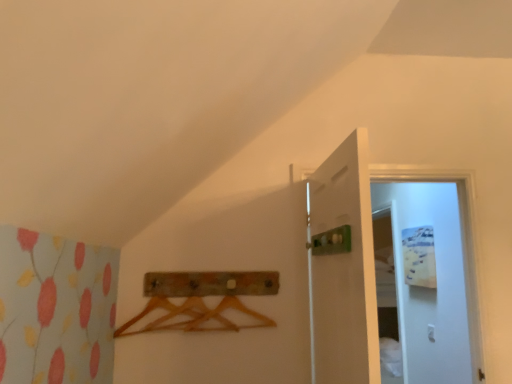
Locate an element on the screen. Image resolution: width=512 pixels, height=384 pixels. wooden coat hanger at center is located at coordinates (210, 283).

What do you see at coordinates (391, 271) in the screenshot? The height and width of the screenshot is (384, 512). I see `white glossy door at upper right, the second door viewed from the left` at bounding box center [391, 271].

This screenshot has width=512, height=384. I want to click on wooden coat hanger at center, so click(x=210, y=283).

Is point (375, 322) positioned after point (277, 292)?

No, (375, 322) is closer to viewer.

Which is behind, white glossy door at upper right, the second door viewed from the left, or wooden coat hanger at center?

wooden coat hanger at center is behind.

Is white glossy door at upper right, the second door viewed from the left, positioned with its back to wooden coat hanger at center?

white glossy door at upper right, the second door viewed from the left, does not have its back to wooden coat hanger at center.

In terms of width, does wooden coat hanger at center look wider or thinner when compared to white matte door at center, the 1th door in the left-to-right sequence?

wooden coat hanger at center is thinner than white matte door at center, the 1th door in the left-to-right sequence.

Is wooden coat hanger at center at the right side of white matte door at center, placed as the 2th door when sorted from right to left?

Incorrect, wooden coat hanger at center is not on the right side of white matte door at center, placed as the 2th door when sorted from right to left.

Is wooden coat hanger at center not near white matte door at center, the 1th door in the left-to-right sequence?

wooden coat hanger at center is actually quite close to white matte door at center, the 1th door in the left-to-right sequence.

Is the position of wooden coat hanger at center less distant than that of white matte door at center, the 1th door in the left-to-right sequence?

No, wooden coat hanger at center is further to the viewer.

Which object is wider, white matte door at center, the 1th door in the left-to-right sequence, or white glossy door at upper right, the second door viewed from the left?

Wider between the two is white glossy door at upper right, the second door viewed from the left.

From the image's perspective, which is above, white matte door at center, the 1th door in the left-to-right sequence, or white glossy door at upper right, the first door viewed from the right?

white matte door at center, the 1th door in the left-to-right sequence, from the image's perspective.

Looking at this image, from a real-world perspective, is white matte door at center, the 1th door in the left-to-right sequence, on top of white glossy door at upper right, the second door viewed from the left?

Incorrect, from a real-world perspective, white matte door at center, the 1th door in the left-to-right sequence, is lower than white glossy door at upper right, the second door viewed from the left.

Can you confirm if white matte door at center, placed as the 2th door when sorted from right to left, is positioned to the left of white glossy door at upper right, the second door viewed from the left?

Indeed, white matte door at center, placed as the 2th door when sorted from right to left, is positioned on the left side of white glossy door at upper right, the second door viewed from the left.

Considering the points (234, 292) and (407, 202), which point is in front, point (234, 292) or point (407, 202)?

The point (234, 292) is in front.

Consider the image. Considering the sizes of wooden coat hanger at center and white glossy door at upper right, the second door viewed from the left, in the image, is wooden coat hanger at center wider or thinner than white glossy door at upper right, the second door viewed from the left,?

Clearly, wooden coat hanger at center has less width compared to white glossy door at upper right, the second door viewed from the left.

In the image, is wooden coat hanger at center on the left side or the right side of white glossy door at upper right, the second door viewed from the left?

In the image, wooden coat hanger at center appears on the left side of white glossy door at upper right, the second door viewed from the left.

Is wooden coat hanger at center not within white glossy door at upper right, the first door viewed from the right?

Absolutely, wooden coat hanger at center is external to white glossy door at upper right, the first door viewed from the right.

From the image's perspective, between white matte door at center, the 1th door in the left-to-right sequence, and wooden coat hanger at center, which one is located above?

white matte door at center, the 1th door in the left-to-right sequence, is shown above in the image.

Is white matte door at center, placed as the 2th door when sorted from right to left, completely or partially outside of wooden coat hanger at center?

white matte door at center, placed as the 2th door when sorted from right to left, lies outside wooden coat hanger at center's area.

Does white matte door at center, the 1th door in the left-to-right sequence, come in front of wooden coat hanger at center?

Yes.

Considering the positions of points (367, 146) and (250, 291), is point (367, 146) closer to camera compared to point (250, 291)?

That is True.

Is white glossy door at upper right, the first door viewed from the right, in front of or behind white matte door at center, the 1th door in the left-to-right sequence, in the image?

Clearly, white glossy door at upper right, the first door viewed from the right, is behind white matte door at center, the 1th door in the left-to-right sequence.

Based on the photo, is white glossy door at upper right, the first door viewed from the right, with white matte door at center, placed as the 2th door when sorted from right to left?

There is a gap between white glossy door at upper right, the first door viewed from the right, and white matte door at center, placed as the 2th door when sorted from right to left.

Can you confirm if white glossy door at upper right, the first door viewed from the right, is wider than white matte door at center, the 1th door in the left-to-right sequence?

Yes, white glossy door at upper right, the first door viewed from the right, is wider than white matte door at center, the 1th door in the left-to-right sequence.

From their relative heights in the image, would you say white glossy door at upper right, the first door viewed from the right, is taller or shorter than white matte door at center, the 1th door in the left-to-right sequence?

Considering their sizes, white glossy door at upper right, the first door viewed from the right, has more height than white matte door at center, the 1th door in the left-to-right sequence.

Identify the location of drawer behind the white glossy door at upper right, the second door viewed from the left. Image resolution: width=512 pixels, height=384 pixels. (210, 283).

This screenshot has width=512, height=384. I want to click on drawer below the white matte door at center, the 1th door in the left-to-right sequence (from a real-world perspective), so [x=210, y=283].

Which object lies further to the anchor point white glossy door at upper right, the first door viewed from the right, white matte door at center, placed as the 2th door when sorted from right to left, or wooden coat hanger at center?

Based on the image, wooden coat hanger at center appears to be further to white glossy door at upper right, the first door viewed from the right.

Looking at the image, which one is located closer to white matte door at center, the 1th door in the left-to-right sequence, white glossy door at upper right, the first door viewed from the right, or wooden coat hanger at center?

wooden coat hanger at center is positioned closer to the anchor white matte door at center, the 1th door in the left-to-right sequence.

Based on their spatial positions, is wooden coat hanger at center or white glossy door at upper right, the second door viewed from the left, closer to white matte door at center, the 1th door in the left-to-right sequence?

wooden coat hanger at center.

When comparing their distances from white glossy door at upper right, the first door viewed from the right, does wooden coat hanger at center or white matte door at center, the 1th door in the left-to-right sequence, seem closer?

white matte door at center, the 1th door in the left-to-right sequence, lies closer to white glossy door at upper right, the first door viewed from the right, than the other object.

When comparing their distances from wooden coat hanger at center, does white glossy door at upper right, the second door viewed from the left, or white matte door at center, the 1th door in the left-to-right sequence, seem further?

Among the two, white glossy door at upper right, the second door viewed from the left, is located further to wooden coat hanger at center.

Estimate the real-world distances between objects in this image. Which object is closer to wooden coat hanger at center, white matte door at center, the 1th door in the left-to-right sequence, or white glossy door at upper right, the first door viewed from the right?

The object closer to wooden coat hanger at center is white matte door at center, the 1th door in the left-to-right sequence.

Find the location of `door between wooden coat hanger at center and white glossy door at upper right, the second door viewed from the left, in the horizontal direction`. door between wooden coat hanger at center and white glossy door at upper right, the second door viewed from the left, in the horizontal direction is located at coordinates (344, 269).